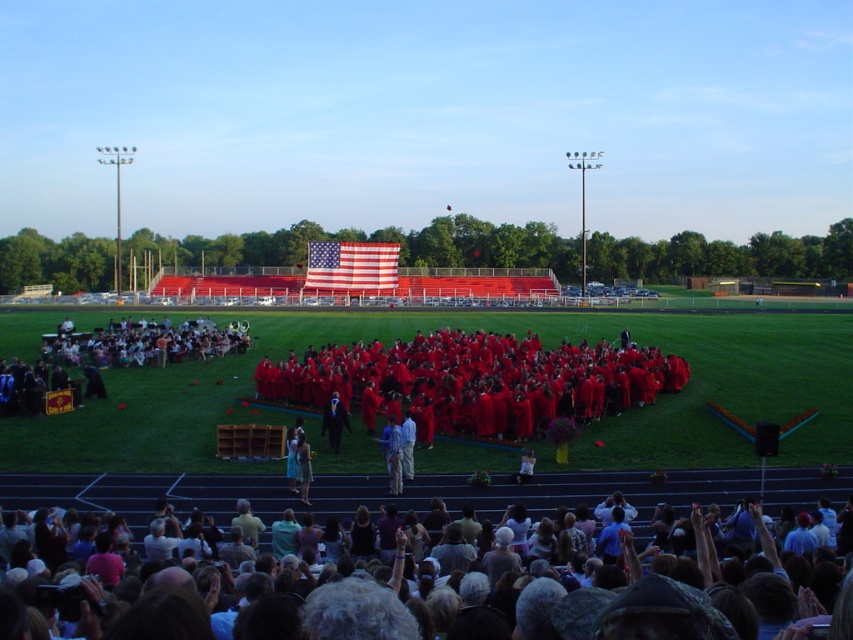
Is red matte graduation gowns at center in front of blue fabric shirt at center?

No, it is behind blue fabric shirt at center.

Who is positioned more to the right, red matte graduation gowns at center or blue fabric shirt at center?

Positioned to the right is red matte graduation gowns at center.

At what (x,y) coordinates should I click in order to perform the action: click on red matte graduation gowns at center. Please return your answer as a coordinate pair (x, y). Looking at the image, I should click on (474, 381).

Where is `red matte graduation gowns at center`? The height and width of the screenshot is (640, 853). red matte graduation gowns at center is located at coordinates (474, 381).

Which of these two, red matte graduation gowns at center or matte red graduation gowns at lower center, stands taller?

red matte graduation gowns at center is taller.

Can you confirm if red matte graduation gowns at center is shorter than matte red graduation gowns at lower center?

No, red matte graduation gowns at center is not shorter than matte red graduation gowns at lower center.

At what (x,y) coordinates should I click in order to perform the action: click on red matte graduation gowns at center. Please return your answer as a coordinate pair (x, y). Looking at the image, I should click on (474, 381).

I want to click on red matte graduation gowns at center, so click(x=474, y=381).

Who is positioned more to the left, red matte graduation gowns at center or dark blue suit at center?

From the viewer's perspective, dark blue suit at center appears more on the left side.

Looking at this image, which of these two, red matte graduation gowns at center or dark blue suit at center, stands taller?

red matte graduation gowns at center

The width and height of the screenshot is (853, 640). What do you see at coordinates (474, 381) in the screenshot?
I see `red matte graduation gowns at center` at bounding box center [474, 381].

Locate an element on the screen. red matte graduation gowns at center is located at coordinates (474, 381).